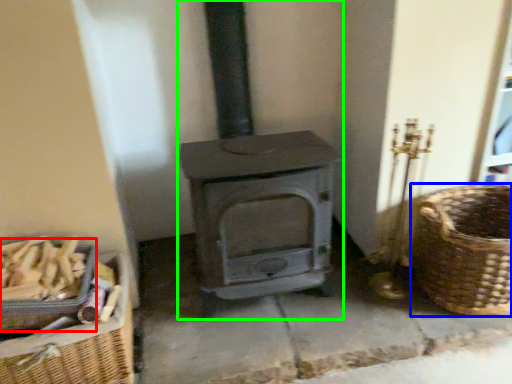
Question: Which object is positioned farthest from basket (highlighted by a red box)? Select from basket (highlighted by a blue box) and wood burning stove (highlighted by a green box).

Choices:
 (A) basket
 (B) wood burning stove

Answer: (A)